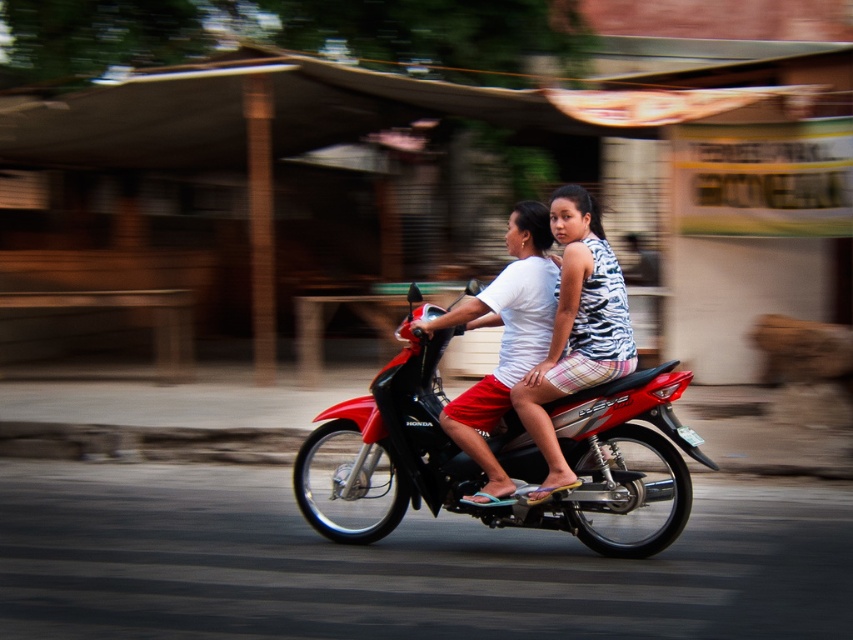
What are the coordinates of the shiny red motorcycle at center?

The shiny red motorcycle at center is located at point (479, 465).

You are a photographer who wants to take a clear photo of the shiny red motorcycle at center and the white matte shirt at center. Which object should you focus on to ensure it appears sharp in the photo?

The shiny red motorcycle at center is closer to the viewer than the white matte shirt at center, so focusing on the shiny red motorcycle at center will ensure it appears sharp. However, due to the shallow depth of field mentioned in the scene description, the white matte shirt at center may appear slightly blurred even if focused properly.

You are a fashion designer observing the two riders on the red Honda motorbike. You notice the patterned fabric shirt at center and the white matte shirt at center. Which shirt is closer to the camera?

The patterned fabric shirt at center and white matte shirt at center are 23.60 centimeters apart from each other, so it is impossible to determine which one is closer to the camera based on the given information.